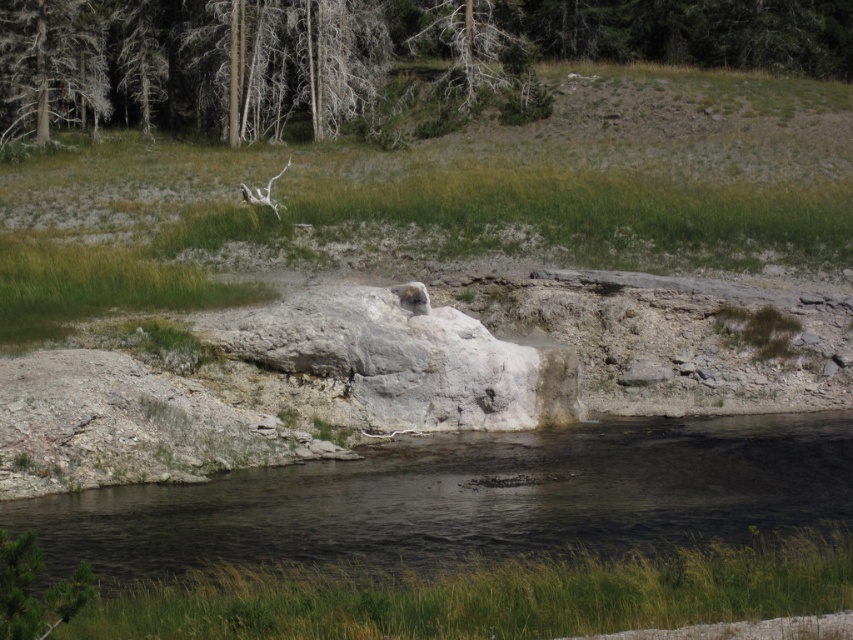
Question: Which of the following is the closest to the observer?

Choices:
 (A) dead wood at upper left
 (B) black smooth water at lower center

Answer: (B)

Question: Can you confirm if black smooth water at lower center is positioned to the left of dead wood tree at upper center?

Choices:
 (A) yes
 (B) no

Answer: (B)

Question: Which point is farther to the camera?

Choices:
 (A) (65, 115)
 (B) (442, 10)
 (C) (733, 497)

Answer: (B)

Question: Where is black smooth water at lower center located in relation to dead wood tree at upper center in the image?

Choices:
 (A) left
 (B) right

Answer: (B)

Question: Estimate the real-world distances between objects in this image. Which object is closer to the dead wood at upper left?

Choices:
 (A) black smooth water at lower center
 (B) dead wood tree at upper center

Answer: (B)

Question: Is black smooth water at lower center positioned before dead wood at upper left?

Choices:
 (A) no
 (B) yes

Answer: (B)